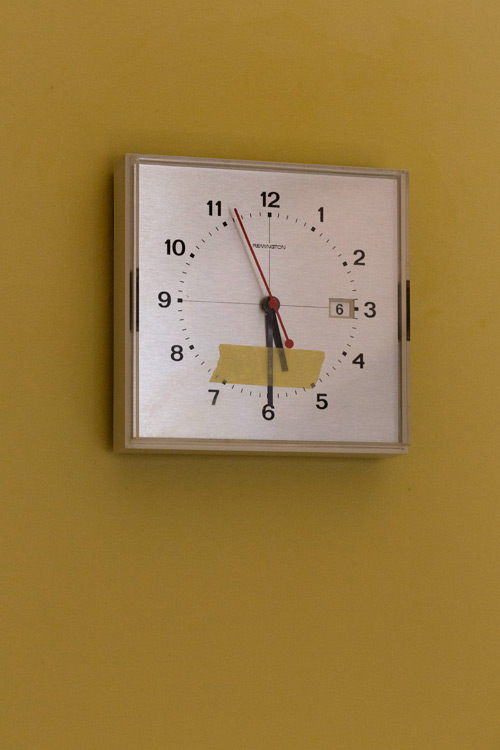
Locate an element on the screen. The height and width of the screenshot is (750, 500). clock is located at coordinates (303, 272).